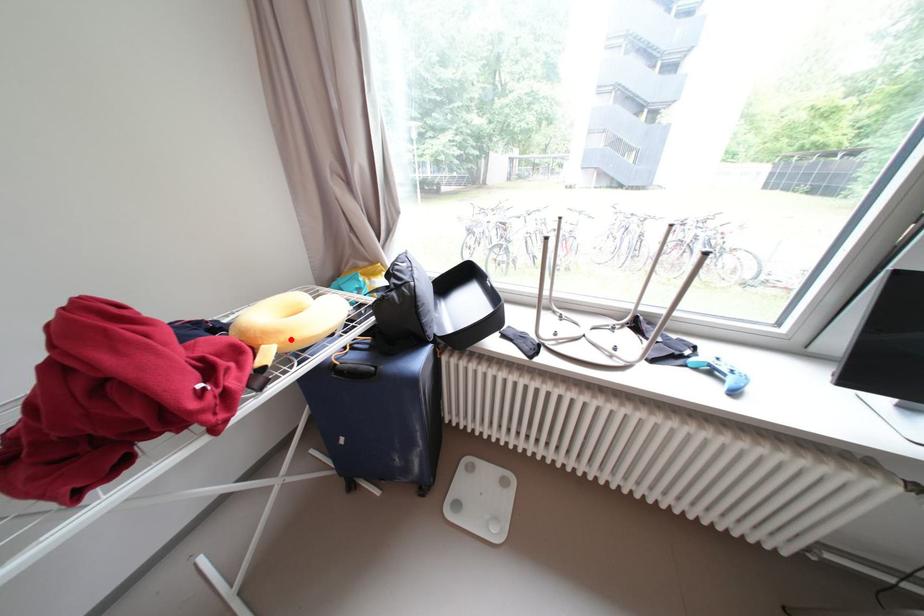
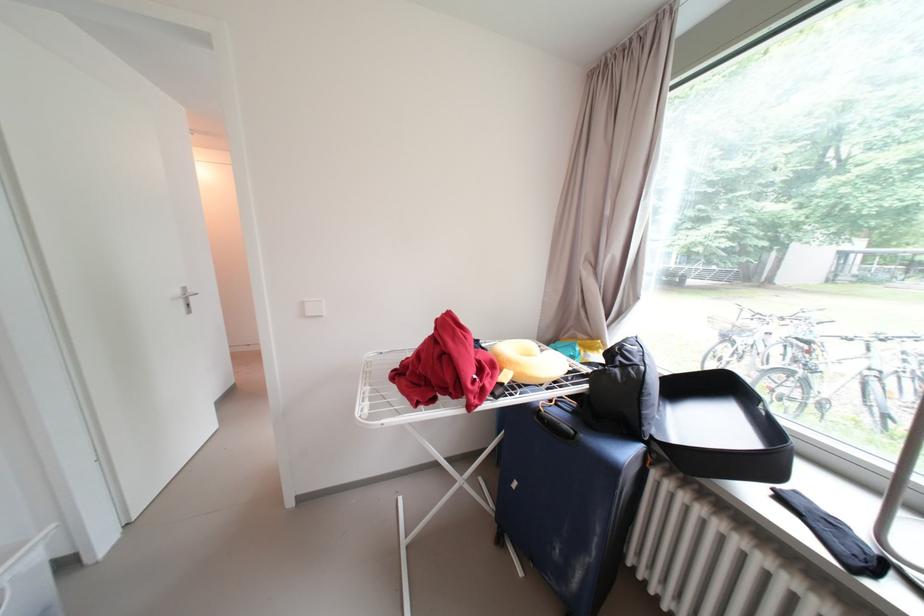
Find the pixel in the second image that matches the highlighted location in the first image.

(527, 371)